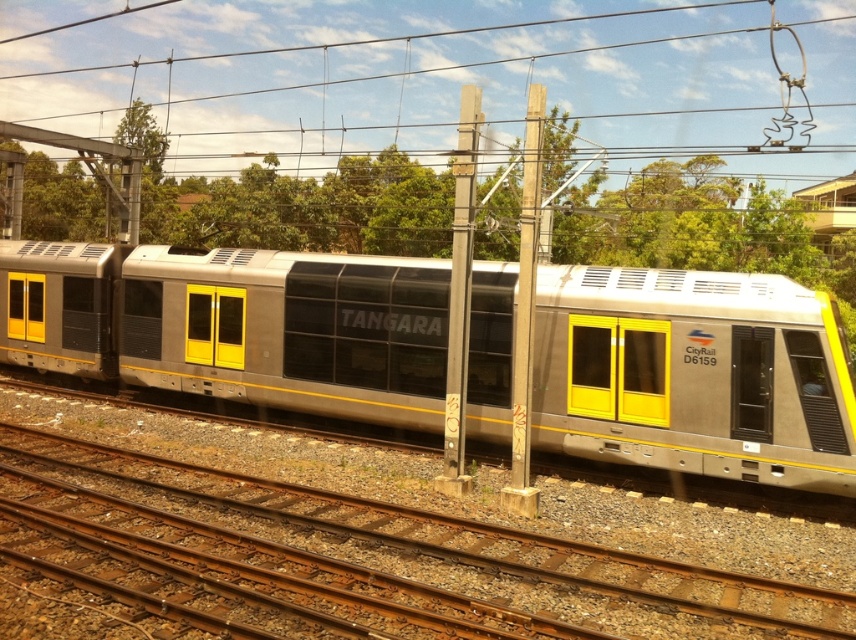
Question: Is metallic wire at upper center to the left of matte silver train car at left from the viewer's perspective?

Choices:
 (A) no
 (B) yes

Answer: (A)

Question: Is metallic silver train at center to the right of matte silver train car at left from the viewer's perspective?

Choices:
 (A) yes
 (B) no

Answer: (A)

Question: Which of the following is the closest to the observer?

Choices:
 (A) (412, 605)
 (B) (525, 193)

Answer: (A)

Question: Which object is positioned closest to the brown gravel at lower center?

Choices:
 (A) metallic silver train at center
 (B) matte silver train car at left
 (C) metallic gray pole at center

Answer: (C)

Question: Does metallic silver train at center appear over smooth wood pole at center?

Choices:
 (A) no
 (B) yes

Answer: (A)

Question: Which object appears closest to the camera in this image?

Choices:
 (A) metallic gray pole at center
 (B) smooth wood pole at center

Answer: (B)